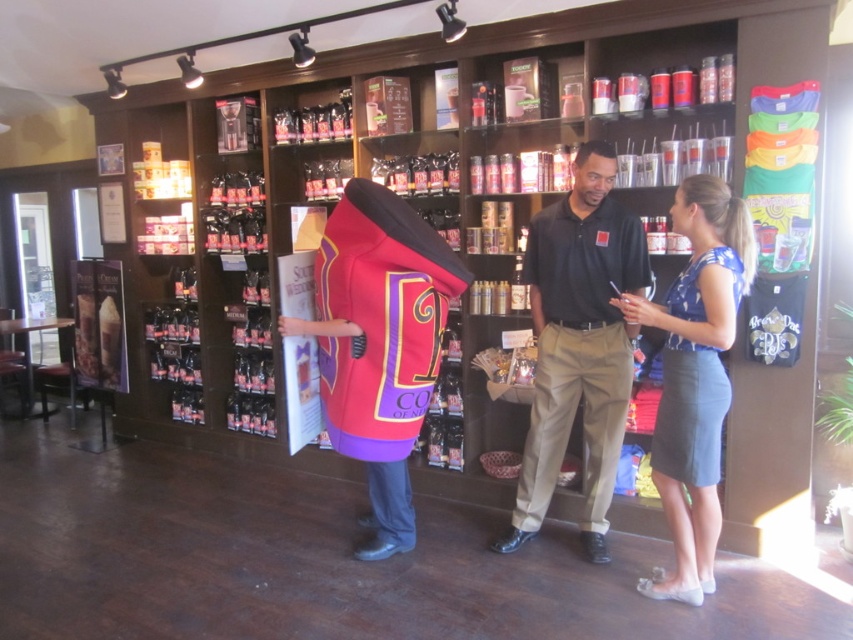
Question: Is black cotton polo shirt at center closer to the viewer compared to blue satin blouse at center?

Choices:
 (A) yes
 (B) no

Answer: (B)

Question: Among these points, which one is nearest to the camera?

Choices:
 (A) (717, 273)
 (B) (605, 316)

Answer: (A)

Question: Which point is closer to the camera?

Choices:
 (A) black cotton polo shirt at center
 (B) blue satin blouse at center

Answer: (B)

Question: Can you confirm if black cotton polo shirt at center is positioned to the left of blue satin blouse at center?

Choices:
 (A) yes
 (B) no

Answer: (A)

Question: Does black cotton polo shirt at center appear under blue satin blouse at center?

Choices:
 (A) no
 (B) yes

Answer: (A)